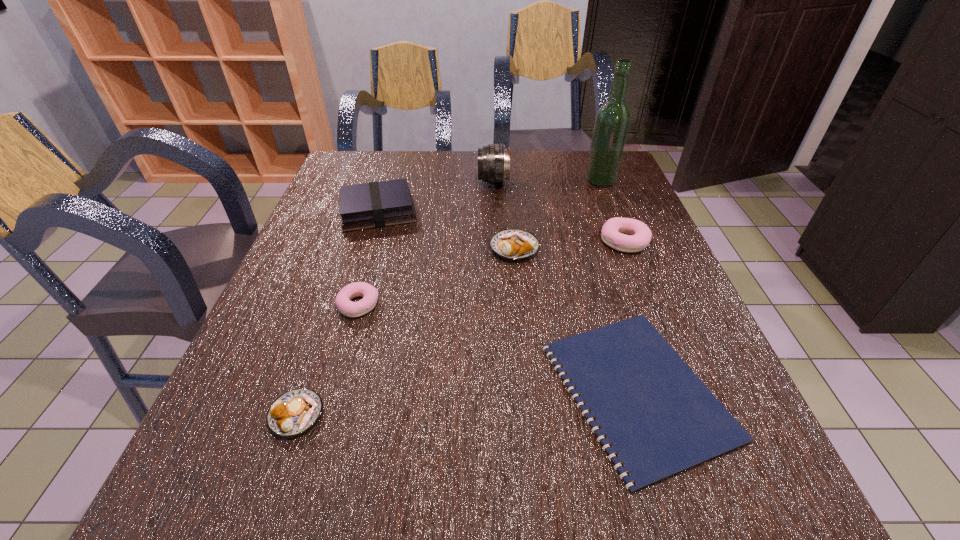
Where is `blank space at the near right corner of the desktop`? The width and height of the screenshot is (960, 540). blank space at the near right corner of the desktop is located at coordinates (713, 510).

Find the location of a particular element. This screenshot has width=960, height=540. free space between the blue notepad and the blue book is located at coordinates (507, 301).

The height and width of the screenshot is (540, 960). What are the coordinates of `vacant space that is in between the telephoto lens and the blue notepad` in the screenshot? It's located at (565, 286).

Locate an element on the screen. free space between the sixth shortest object and the notepad is located at coordinates (507, 301).

Identify the location of vacant area between the notepad and the third pastry from left to right. (576, 320).

Where is `vacant area that lies between the farther pink pastry and the shortest object`? vacant area that lies between the farther pink pastry and the shortest object is located at coordinates (631, 316).

I want to click on empty space that is in between the nearest pastry and the shortest object, so click(x=467, y=403).

I want to click on blank region between the shortest object and the farther brown pastry, so click(x=576, y=320).

Find the location of a particular element. The image size is (960, 540). free space between the seventh shortest object and the third pastry from left to right is located at coordinates (504, 215).

I want to click on unoccupied position between the nearer brown pastry and the second tallest object, so click(395, 298).